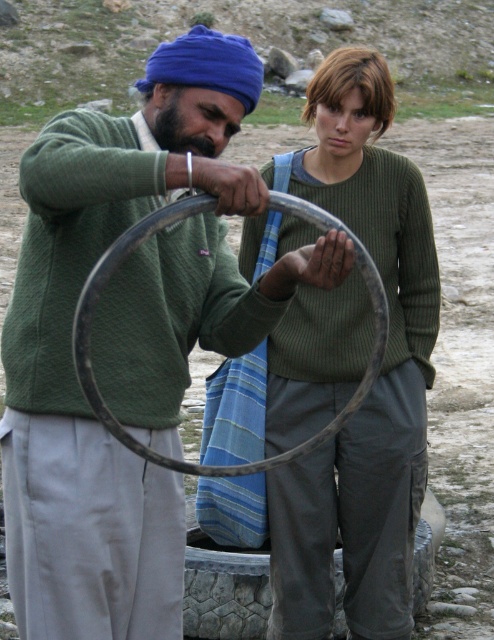
You are designing a costume for a performance where the green ribbed sweater at center must fit over the metallic silver hula hoop at center. Based on the scene description, will the sweater be able to stretch over the hula hoop?

The green ribbed sweater at center is narrower than the metallic silver hula hoop at center, so the sweater may not stretch over the hula hoop since its width is insufficient to accommodate the hoop.